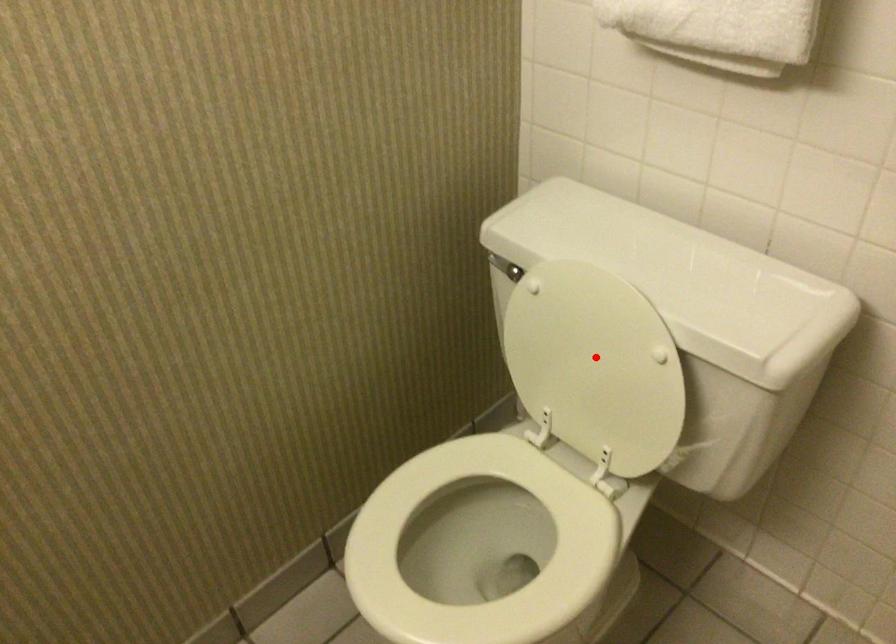
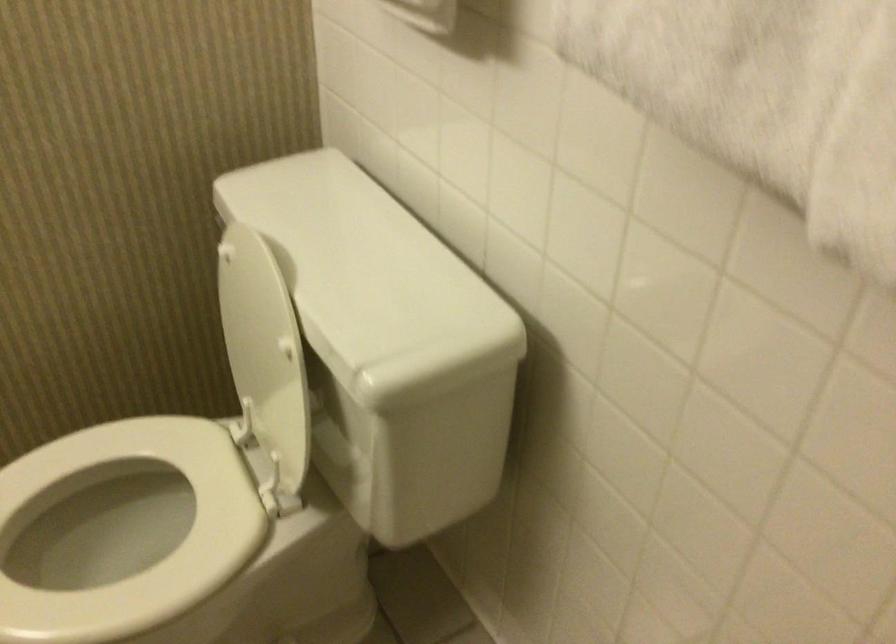
Question: I am providing you with two images of the same scene from different viewpoints. A red point is shown in image1. For the corresponding object point in image2, is it positioned nearer or farther from the camera?

Choices:
 (A) Nearer
 (B) Farther

Answer: (A)